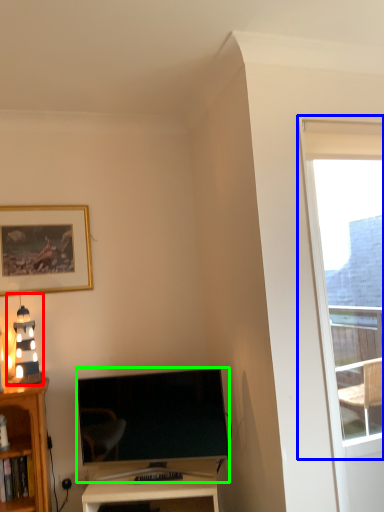
Question: Which object is positioned closest to light fixture (highlighted by a red box)? Select from window (highlighted by a blue box) and television (highlighted by a green box).

Choices:
 (A) window
 (B) television

Answer: (B)